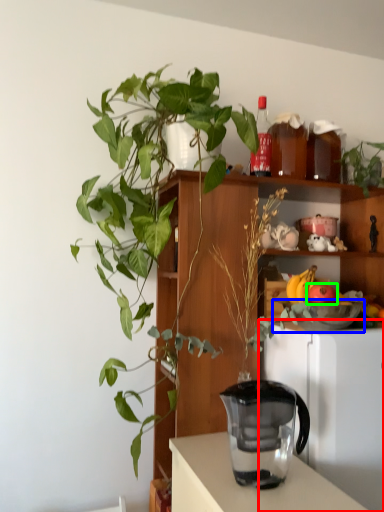
Question: Which is farther away from appliance (highlighted by a red box)? bowl (highlighted by a blue box) or apple (highlighted by a green box)?

Choices:
 (A) bowl
 (B) apple

Answer: (B)